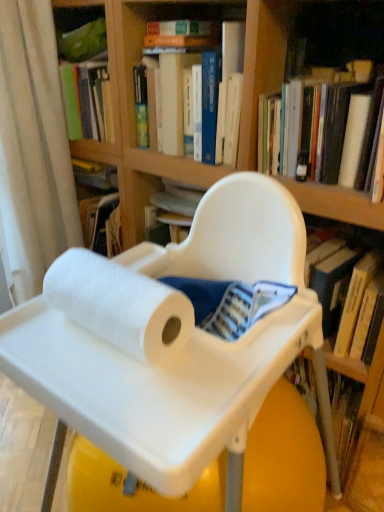
Describe the element at coordinates (321, 130) in the screenshot. I see `white matte book at upper right, which is counted as the 1th book, starting from the right` at that location.

In order to face white plastic tray at center, should I rotate leftwards or rightwards?

To face it directly, rotate right by 0.541 degrees.

Find the location of `white plastic tray at center`. white plastic tray at center is located at coordinates (326, 419).

What is the approximate width of blue hardcover book at upper center, the 2th book positioned from the right?

blue hardcover book at upper center, the 2th book positioned from the right, is 30.32 centimeters wide.

How much space does blue hardcover book at upper center, which ranks as the first book in left-to-right order, occupy vertically?

blue hardcover book at upper center, which ranks as the first book in left-to-right order, is 13.73 inches tall.

You are a GUI agent. You are given a task and a screenshot of the screen. Output one action in this format:
    pyautogui.click(x=<x>, y=<y>)
    Task: Click on the white fabric curtain at left
    The width and height of the screenshot is (384, 512).
    Given the screenshot: What is the action you would take?
    pyautogui.click(x=33, y=150)

At what (x,y) coordinates should I click in order to perform the action: click on white matte book at upper right, which is counted as the 1th book, starting from the right. Please return your answer as a coordinate pair (x, y). The width and height of the screenshot is (384, 512). Looking at the image, I should click on (321, 130).

Is blue hardcover book at upper center, the 2th book positioned from the right, placed right next to white fabric curtain at left?

No.

Can you confirm if blue hardcover book at upper center, which ranks as the first book in left-to-right order, is wider than white fabric curtain at left?

Indeed, blue hardcover book at upper center, which ranks as the first book in left-to-right order, has a greater width compared to white fabric curtain at left.

Can you tell me how much blue hardcover book at upper center, the 2th book positioned from the right, and white fabric curtain at left differ in facing direction?

blue hardcover book at upper center, the 2th book positioned from the right, and white fabric curtain at left are facing 89.9 degrees away from each other.

Between blue hardcover book at upper center, the 2th book positioned from the right, and white fabric curtain at left, which one has more height?

With more height is white fabric curtain at left.

Considering the positions of objects white paper towel at center and blue hardcover book at upper center, the 2th book positioned from the right, in the image provided, who is more to the left, white paper towel at center or blue hardcover book at upper center, the 2th book positioned from the right,?

From the viewer's perspective, white paper towel at center appears more on the left side.

Where is `paper towel in front of the blue hardcover book at upper center, which ranks as the first book in left-to-right order`? This screenshot has width=384, height=512. paper towel in front of the blue hardcover book at upper center, which ranks as the first book in left-to-right order is located at coordinates (120, 305).

Between white paper towel at center and blue hardcover book at upper center, the 2th book positioned from the right, which one is positioned behind?

blue hardcover book at upper center, the 2th book positioned from the right.

Would you consider white fabric curtain at left to be distant from white paper towel at center?

white fabric curtain at left is near white paper towel at center, not far away.

Between white fabric curtain at left and white paper towel at center, which one has larger size?

white fabric curtain at left.

Locate an element on the screen. This screenshot has height=512, width=384. paper towel located above the white fabric curtain at left (from a real-world perspective) is located at coordinates (120, 305).

Does white fabric curtain at left lie in front of white paper towel at center?

No, white fabric curtain at left is further to the viewer.

Is white plastic tray at center aimed at blue hardcover book at upper center, the 2th book positioned from the right?

No, white plastic tray at center is not turned towards blue hardcover book at upper center, the 2th book positioned from the right.

The width and height of the screenshot is (384, 512). Find the location of `table on the left of blue hardcover book at upper center, the 2th book positioned from the right`. table on the left of blue hardcover book at upper center, the 2th book positioned from the right is located at coordinates (326, 419).

Which is correct: white plastic tray at center is inside blue hardcover book at upper center, the 2th book positioned from the right, or outside of it?

The correct answer is: outside.

From the image's perspective, between white plastic tray at center and blue hardcover book at upper center, the 2th book positioned from the right, which one is located above?

blue hardcover book at upper center, the 2th book positioned from the right, is shown above in the image.

Is white fabric curtain at left facing away from white matte book at upper right, acting as the 2th book starting from the left?

white fabric curtain at left does not have its back to white matte book at upper right, acting as the 2th book starting from the left.

Considering the relative positions of white fabric curtain at left and white matte book at upper right, which is counted as the 1th book, starting from the right, in the image provided, is white fabric curtain at left in front of white matte book at upper right, which is counted as the 1th book, starting from the right,?

No, white fabric curtain at left is behind white matte book at upper right, which is counted as the 1th book, starting from the right.

Is point (339, 144) closer to viewer compared to point (132, 284)?

No, (339, 144) is further to viewer.

Considering the relative sizes of white matte book at upper right, which is counted as the 1th book, starting from the right, and white paper towel at center in the image provided, is white matte book at upper right, which is counted as the 1th book, starting from the right, wider than white paper towel at center?

Yes.

Is white matte book at upper right, which is counted as the 1th book, starting from the right, positioned beyond the bounds of white paper towel at center?

white matte book at upper right, which is counted as the 1th book, starting from the right, is positioned outside white paper towel at center.

How different are the orientations of white matte book at upper right, which is counted as the 1th book, starting from the right, and white paper towel at center in degrees?

They differ by 1.32 degrees in their facing directions.

Which is behind, blue hardcover book at upper center, the 2th book positioned from the right, or white matte book at upper right, acting as the 2th book starting from the left?

blue hardcover book at upper center, the 2th book positioned from the right, is further away from the camera.

Which of these two, blue hardcover book at upper center, which ranks as the first book in left-to-right order, or white matte book at upper right, which is counted as the 1th book, starting from the right, is bigger?

Bigger between the two is blue hardcover book at upper center, which ranks as the first book in left-to-right order.

Is white matte book at upper right, acting as the 2th book starting from the left, completely or partially inside blue hardcover book at upper center, which ranks as the first book in left-to-right order?

No, blue hardcover book at upper center, which ranks as the first book in left-to-right order, does not contain white matte book at upper right, acting as the 2th book starting from the left.

Which book is the 1st one when counting from the front of the white fabric curtain at left? Please provide its 2D coordinates.

[(225, 99)]

This screenshot has height=512, width=384. Identify the location of paper towel directly beneath the blue hardcover book at upper center, the 2th book positioned from the right (from a real-world perspective). (120, 305).

From the picture: Considering their positions, is blue hardcover book at upper center, the 2th book positioned from the right, positioned further to white matte book at upper right, acting as the 2th book starting from the left, than white paper towel at center?

white paper towel at center.

When comparing their distances from blue hardcover book at upper center, which ranks as the first book in left-to-right order, does white plastic tray at center or white fabric curtain at left seem further?

The object further to blue hardcover book at upper center, which ranks as the first book in left-to-right order, is white plastic tray at center.

Considering their positions, is white fabric curtain at left positioned closer to blue hardcover book at upper center, the 2th book positioned from the right, than white matte book at upper right, which is counted as the 1th book, starting from the right?

white matte book at upper right, which is counted as the 1th book, starting from the right.

Considering their positions, is white fabric curtain at left positioned closer to white plastic tray at center than white paper towel at center?

white paper towel at center lies closer to white plastic tray at center than the other object.

When comparing their distances from white paper towel at center, does white plastic tray at center or white fabric curtain at left seem closer?

The object closer to white paper towel at center is white plastic tray at center.

Which object lies further to the anchor point white matte book at upper right, which is counted as the 1th book, starting from the right, white plastic tray at center or white paper towel at center?

white paper towel at center lies further to white matte book at upper right, which is counted as the 1th book, starting from the right, than the other object.

Looking at this image, considering their positions, is blue hardcover book at upper center, which ranks as the first book in left-to-right order, positioned closer to white plastic tray at center than white paper towel at center?

white paper towel at center.

Which object lies nearer to the anchor point white matte book at upper right, which is counted as the 1th book, starting from the right, white paper towel at center or white fabric curtain at left?

The object closer to white matte book at upper right, which is counted as the 1th book, starting from the right, is white paper towel at center.

At what (x,y) coordinates should I click in order to perform the action: click on paper towel that lies between blue hardcover book at upper center, which ranks as the first book in left-to-right order, and white plastic tray at center from top to bottom. Please return your answer as a coordinate pair (x, y). This screenshot has width=384, height=512. Looking at the image, I should click on (120, 305).

Where is `paper towel between white fabric curtain at left and white matte book at upper right, which is counted as the 1th book, starting from the right`? The image size is (384, 512). paper towel between white fabric curtain at left and white matte book at upper right, which is counted as the 1th book, starting from the right is located at coordinates (120, 305).

Locate an element on the screen. This screenshot has height=512, width=384. book between blue hardcover book at upper center, the 2th book positioned from the right, and white paper towel at center vertically is located at coordinates (321, 130).

Locate an element on the screen. Image resolution: width=384 pixels, height=512 pixels. curtain between white matte book at upper right, acting as the 2th book starting from the left, and white plastic tray at center from top to bottom is located at coordinates coord(33,150).